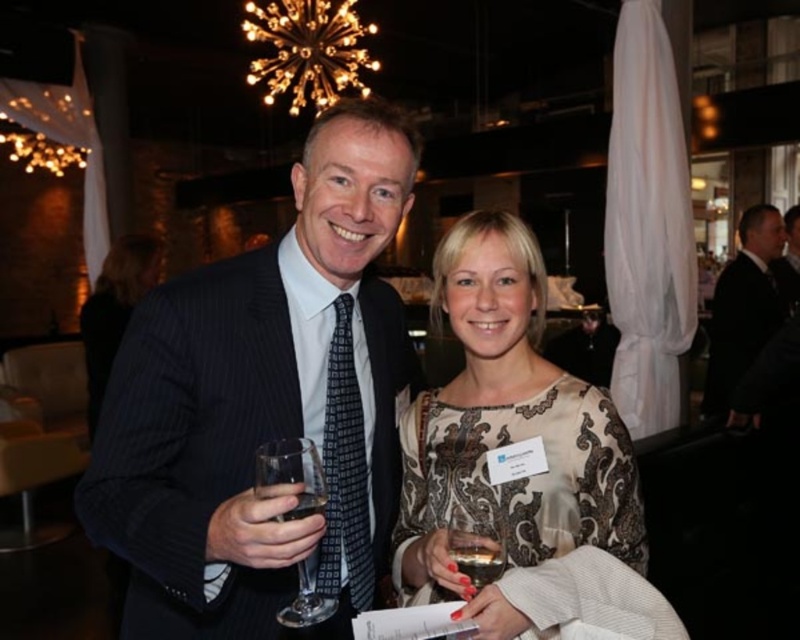
Is point (98, 468) more distant than point (444, 296)?

No, (98, 468) is in front of (444, 296).

Is point (294, 244) closer to viewer compared to point (484, 426)?

Yes, point (294, 244) is in front of point (484, 426).

Is point (222, 260) farther from camera compared to point (556, 529)?

Yes, point (222, 260) is behind point (556, 529).

You are a GUI agent. You are given a task and a screenshot of the screen. Output one action in this format:
    pyautogui.click(x=<x>, y=<y>)
    Task: Click on the matte black suit at center
    The height and width of the screenshot is (640, 800).
    Given the screenshot: What is the action you would take?
    pyautogui.click(x=264, y=403)

Is the position of dark blue suit at right less distant than that of clear glass at center?

No, dark blue suit at right is behind clear glass at center.

Is point (778, 269) positioned after point (294, 506)?

Yes.

Locate an element on the screen. Image resolution: width=800 pixels, height=640 pixels. dark blue suit at right is located at coordinates (788, 260).

Which is behind, point (262, 403) or point (490, 577)?

Point (262, 403)

What do you see at coordinates (264, 403) in the screenshot? I see `matte black suit at center` at bounding box center [264, 403].

Which is behind, point (102, 518) or point (464, 554)?

Positioned behind is point (102, 518).

Find the location of a particular element. The height and width of the screenshot is (640, 800). matte black suit at center is located at coordinates (264, 403).